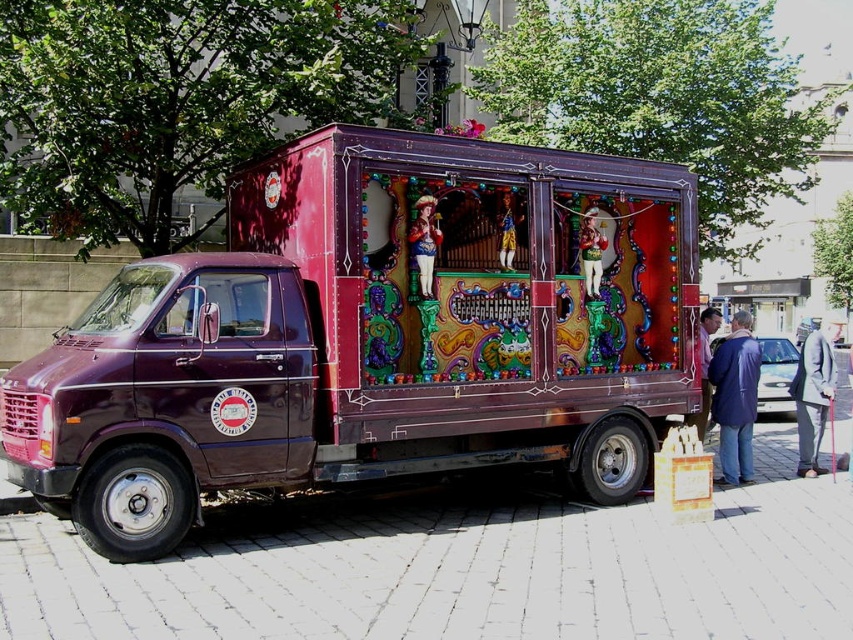
Can you confirm if matte gold figurine at center is bigger than smooth wooden figure at center?

Correct, matte gold figurine at center is larger in size than smooth wooden figure at center.

Can you confirm if matte gold figurine at center is positioned to the right of smooth wooden figure at center?

Indeed, matte gold figurine at center is positioned on the right side of smooth wooden figure at center.

Is point (593, 272) closer to camera compared to point (514, 259)?

No, it is behind (514, 259).

In order to click on matte gold figurine at center in this screenshot , I will do `click(590, 252)`.

Is matte gold statue at center thinner than matte gold figurine at center?

In fact, matte gold statue at center might be wider than matte gold figurine at center.

Which of these two, matte gold statue at center or matte gold figurine at center, stands shorter?

Standing shorter between the two is matte gold statue at center.

Is point (409, 230) less distant than point (595, 220)?

Yes, it is.

At what (x,y) coordinates should I click in order to perform the action: click on matte gold statue at center. Please return your answer as a coordinate pair (x, y). The image size is (853, 640). Looking at the image, I should click on (424, 243).

Is blue leather jacket at lower right further to the viewer compared to light brown leather jacket at lower right?

Yes, blue leather jacket at lower right is behind light brown leather jacket at lower right.

Can you confirm if blue leather jacket at lower right is bigger than light brown leather jacket at lower right?

Incorrect, blue leather jacket at lower right is not larger than light brown leather jacket at lower right.

Between point (720, 480) and point (701, 436), which one is positioned in front?

Point (701, 436)

Identify the location of blue leather jacket at lower right. (735, 397).